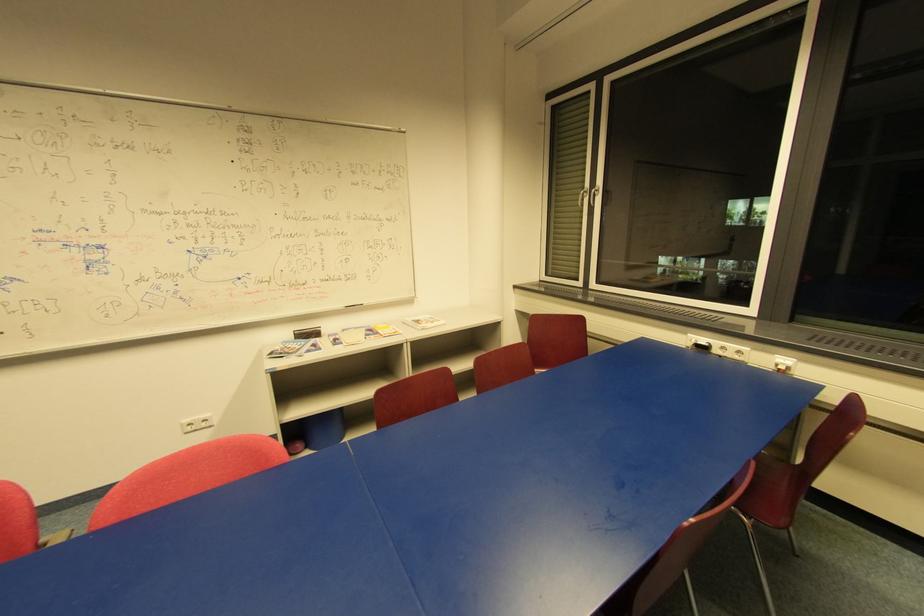
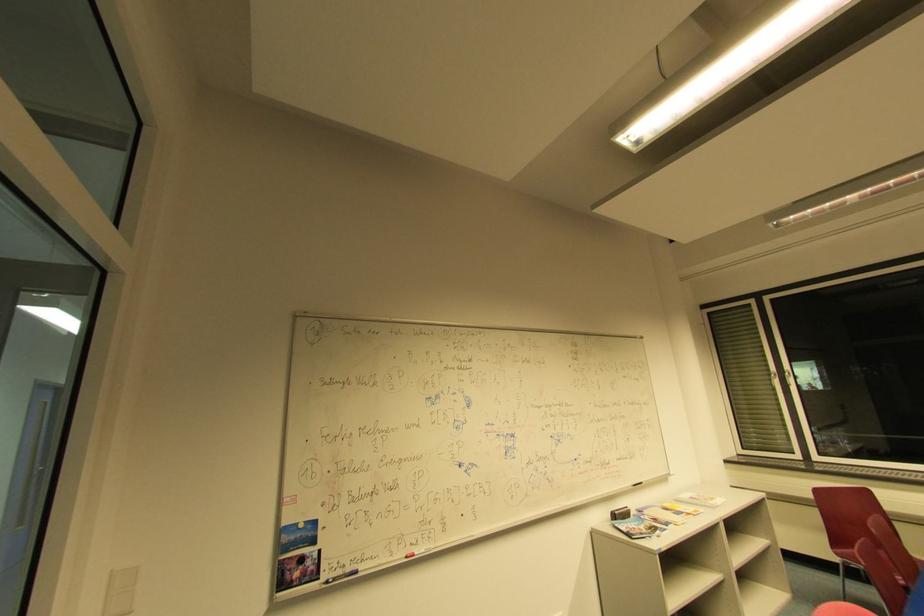
Where in the second image is the point corresponding to [598,192] from the first image?

(791, 375)